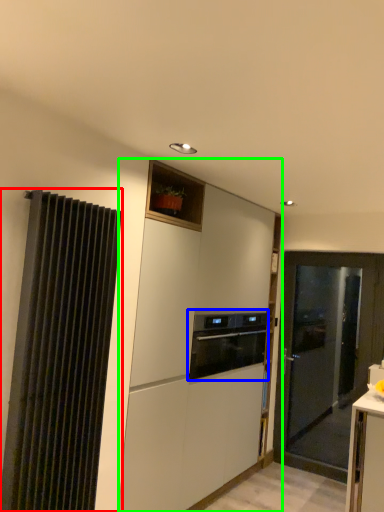
Question: Which object is positioned farthest from curtain (highlighted by a red box)? Select from home appliance (highlighted by a blue box) and cabinetry (highlighted by a green box).

Choices:
 (A) home appliance
 (B) cabinetry

Answer: (A)